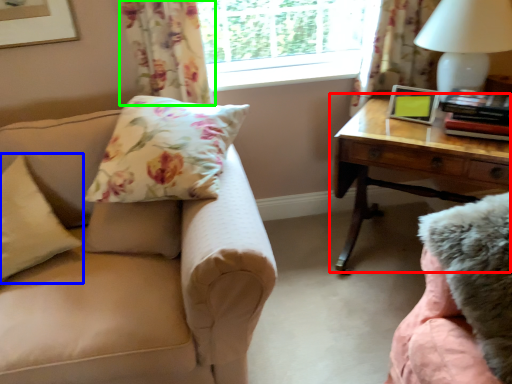
Question: Estimate the real-world distances between objects in this image. Which object is farther from table (highlighted by a red box), pillow (highlighted by a blue box) or curtain (highlighted by a green box)?

Choices:
 (A) pillow
 (B) curtain

Answer: (A)